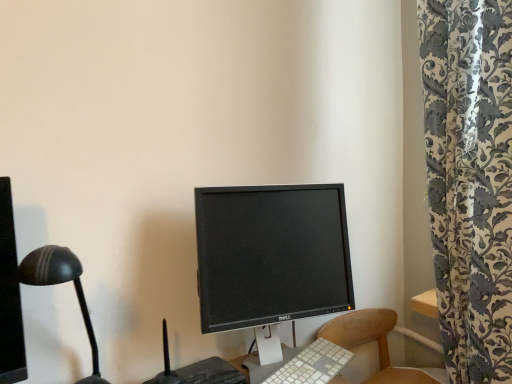
Question: Does white plastic keyboard at center have a greater width compared to black matte desk lamp at left?

Choices:
 (A) yes
 (B) no

Answer: (B)

Question: Is white plastic keyboard at center further to camera compared to black matte desk lamp at left?

Choices:
 (A) no
 (B) yes

Answer: (B)

Question: Does white plastic keyboard at center have a larger size compared to black matte desk lamp at left?

Choices:
 (A) no
 (B) yes

Answer: (A)

Question: From the image's perspective, is white plastic keyboard at center under black matte desk lamp at left?

Choices:
 (A) no
 (B) yes

Answer: (B)

Question: Does white plastic keyboard at center have a greater height compared to black matte desk lamp at left?

Choices:
 (A) yes
 (B) no

Answer: (B)

Question: In terms of width, does black glossy monitor at center look wider or thinner when compared to wooden chair at lower right?

Choices:
 (A) wide
 (B) thin

Answer: (B)

Question: Considering the positions of black glossy monitor at center and wooden chair at lower right in the image, is black glossy monitor at center taller or shorter than wooden chair at lower right?

Choices:
 (A) short
 (B) tall

Answer: (B)

Question: Based on their positions, is black glossy monitor at center located to the left or right of wooden chair at lower right?

Choices:
 (A) left
 (B) right

Answer: (A)

Question: From the image's perspective, is black glossy monitor at center located above or below wooden chair at lower right?

Choices:
 (A) above
 (B) below

Answer: (A)

Question: Considering the relative positions of black glossy monitor at center and white plastic keyboard at center in the image provided, is black glossy monitor at center to the left or to the right of white plastic keyboard at center?

Choices:
 (A) right
 (B) left

Answer: (B)

Question: Considering the positions of black glossy monitor at center and white plastic keyboard at center in the image, is black glossy monitor at center taller or shorter than white plastic keyboard at center?

Choices:
 (A) short
 (B) tall

Answer: (B)

Question: Is black glossy monitor at center inside or outside of white plastic keyboard at center?

Choices:
 (A) outside
 (B) inside

Answer: (A)

Question: Considering the positions of black glossy monitor at center and white plastic keyboard at center in the image, is black glossy monitor at center wider or thinner than white plastic keyboard at center?

Choices:
 (A) thin
 (B) wide

Answer: (B)

Question: Considering the positions of white plastic keyboard at center and black glossy monitor at center in the image, is white plastic keyboard at center wider or thinner than black glossy monitor at center?

Choices:
 (A) thin
 (B) wide

Answer: (A)

Question: Choose the correct answer: Is white plastic keyboard at center inside black glossy monitor at center or outside it?

Choices:
 (A) outside
 (B) inside

Answer: (B)